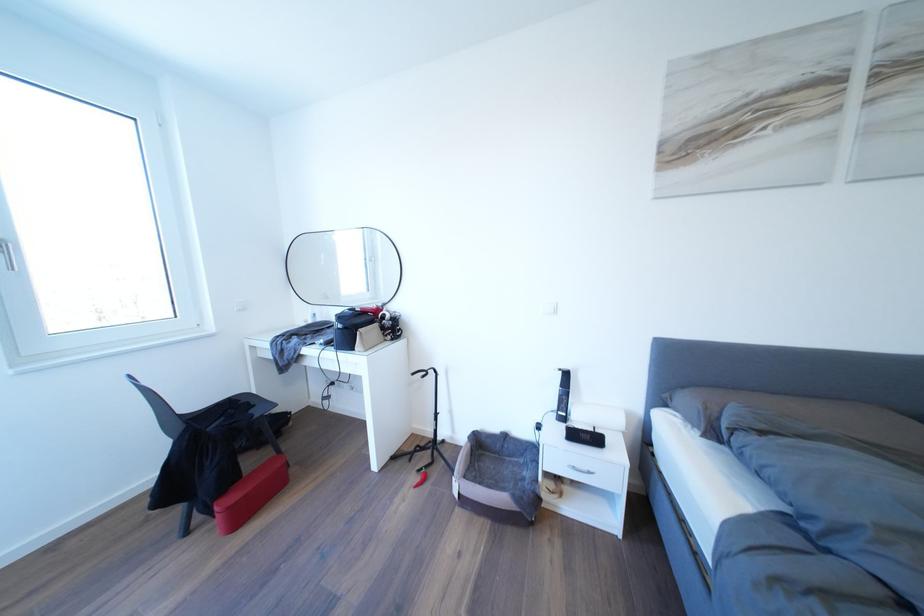
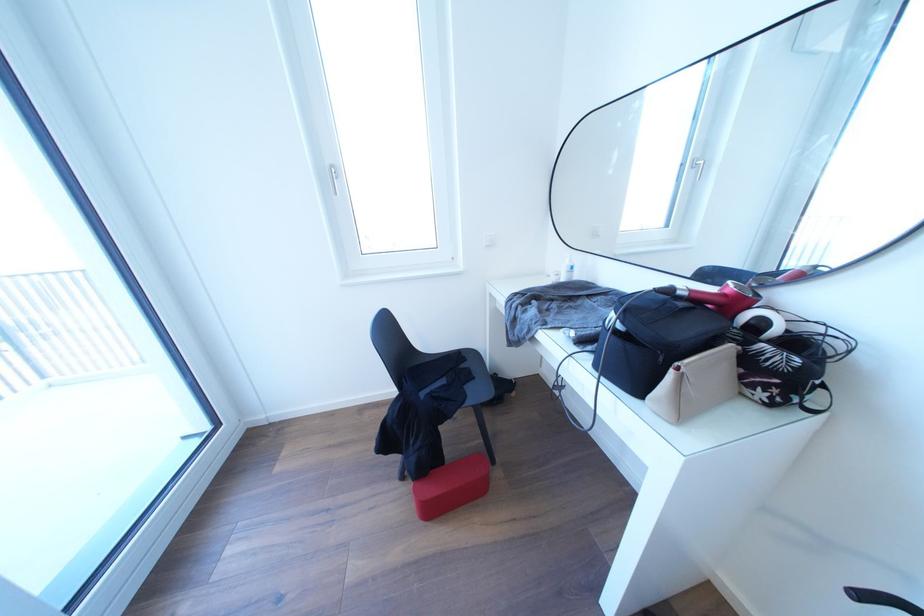
The point at [360,314] is marked in the first image. Where is the corresponding point in the second image?

(675, 296)